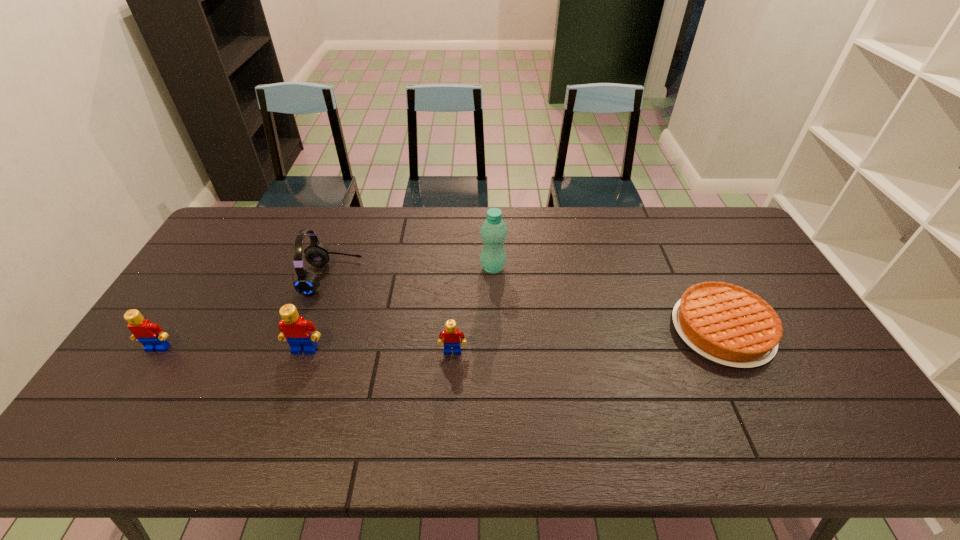
Please point a free position for a Lego on the right. Please provide its 2D coordinates. Your answer should be formatted as a tuple, i.e. [(x, y)], where the tuple contains the x and y coordinates of a point satisfying the conditions above.

[(602, 353)]